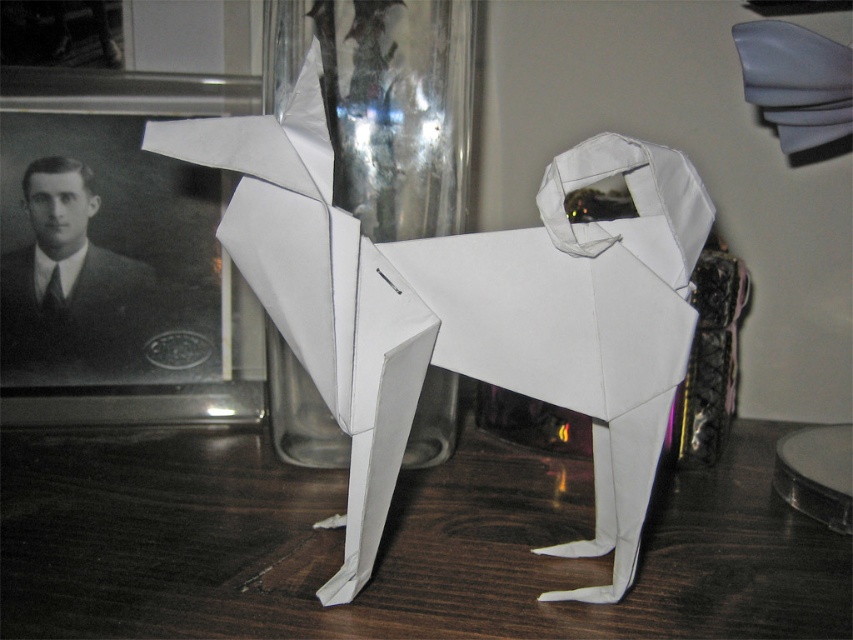
You are standing in front of the wooden table at center. If you want to place the origami dog closer to the framed photograph of the man, which direction should you move it?

The wooden table at center is located at point (392, 547). Since the framed photograph is on the left side of the frame, you should move the origami dog to the left to place it closer to the photograph.